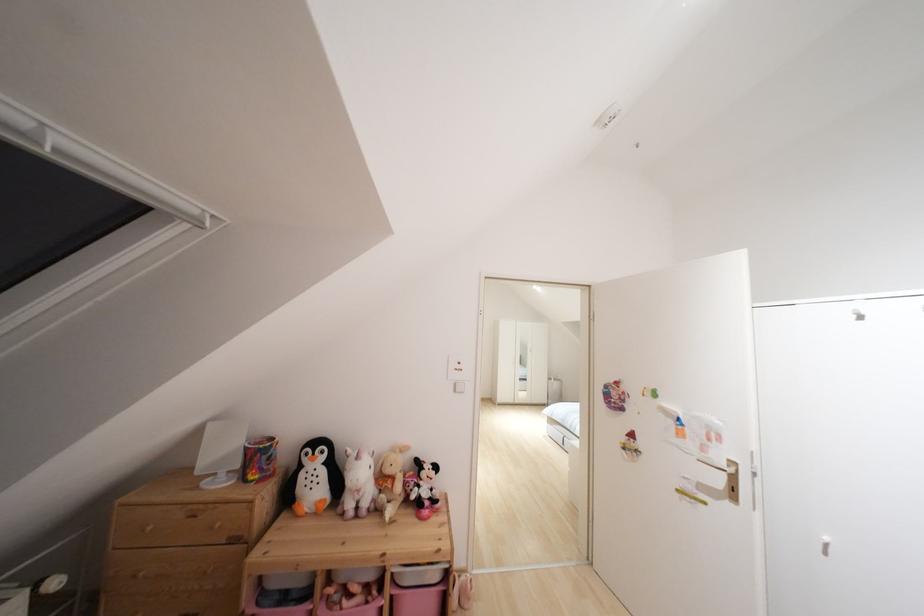
Locate an element on the screen. This screenshot has width=924, height=616. penguin stuffed toy is located at coordinates (313, 477).